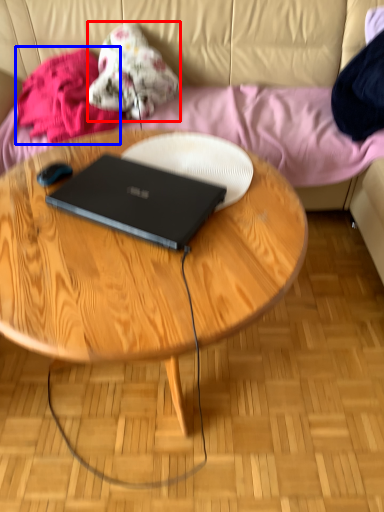
Question: Which object is closer to the camera taking this photo, clothing (highlighted by a red box) or clothing (highlighted by a blue box)?

Choices:
 (A) clothing
 (B) clothing

Answer: (B)